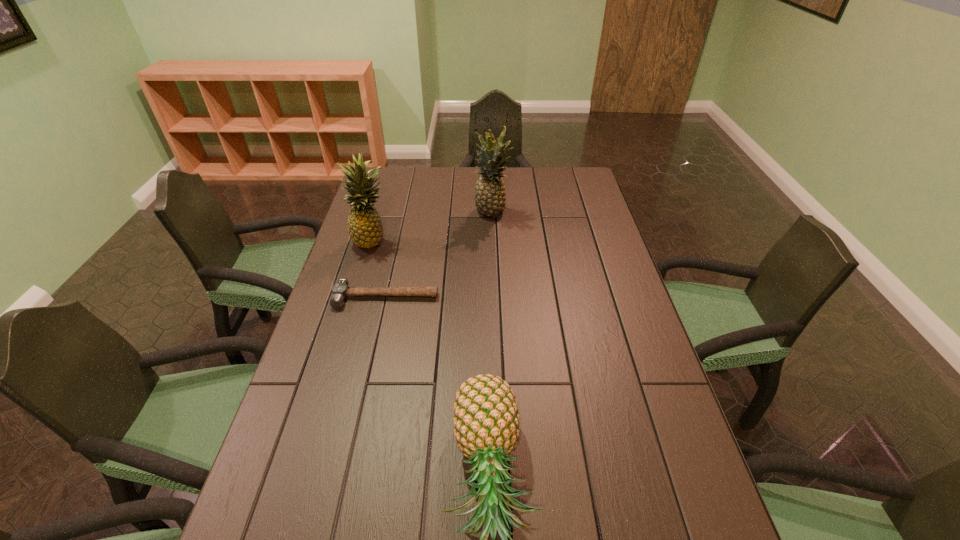
Locate an element on the screen. the farthest pineapple is located at coordinates (490, 197).

Identify the location of the leftmost pineapple. (365, 228).

Locate an element on the screen. The width and height of the screenshot is (960, 540). the second farthest object is located at coordinates (365, 228).

The width and height of the screenshot is (960, 540). I want to click on the third farthest object, so click(340, 291).

Identify the location of hammer. This screenshot has height=540, width=960. click(340, 291).

I want to click on free point located on the left of the farthest pineapple, so click(x=397, y=213).

Locate an element on the screen. This screenshot has width=960, height=540. free location located on the back of the leftmost pineapple is located at coordinates (392, 179).

Locate an element on the screen. The height and width of the screenshot is (540, 960). vacant space positioned on the striking face of the shortest object is located at coordinates (366, 388).

Where is `pineapple at the left edge`? pineapple at the left edge is located at coordinates (365, 228).

Identify the location of hammer at the left edge. The height and width of the screenshot is (540, 960). (340, 291).